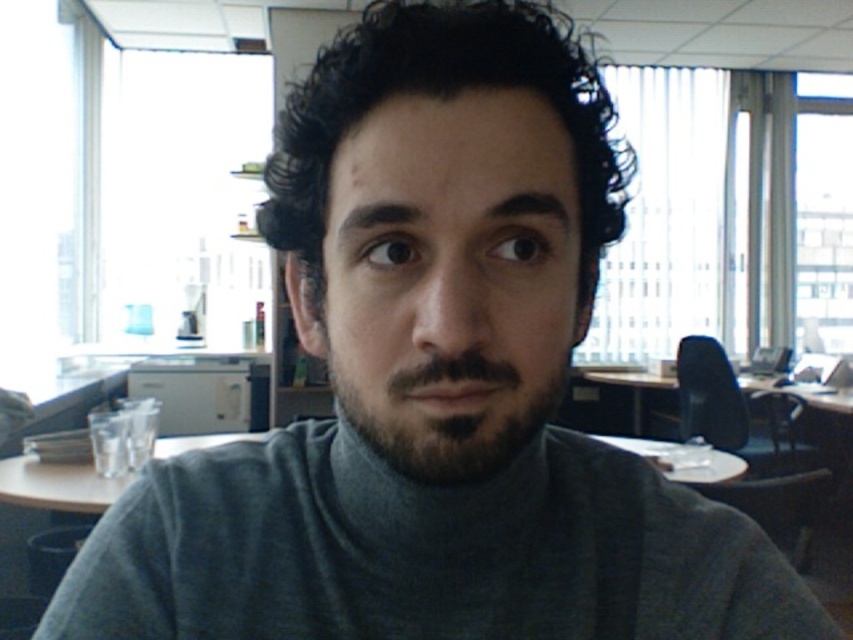
You are a photographer adjusting your camera settings to focus on the subject in the image. You need to ensure that both the gray turtleneck sweater at center and the dark brown fuzzy beard at center are in sharp focus. Given their sizes, which object should you prioritize focusing on first to ensure proper depth of field?

The gray turtleneck sweater at center has a larger size compared to the dark brown fuzzy beard at center, so you should prioritize focusing on the gray turtleneck sweater at center first to ensure proper depth of field.

You are an interior designer analyzing the placement of objects in this image. The gray turtleneck sweater at center is part of the scene. Can you determine its exact coordinates in the image?

The gray turtleneck sweater at center is located at coordinates point [422,552].

You are a photographer adjusting your camera settings to focus on the subject in the image. You notice the gray turtleneck sweater at center and the dark brown fuzzy beard at center. Which object should you focus on first if you want to ensure both are in sharp focus?

You should focus on the gray turtleneck sweater at center first because it is positioned under the dark brown fuzzy beard at center, so focusing on the closer object will ensure both are in focus.